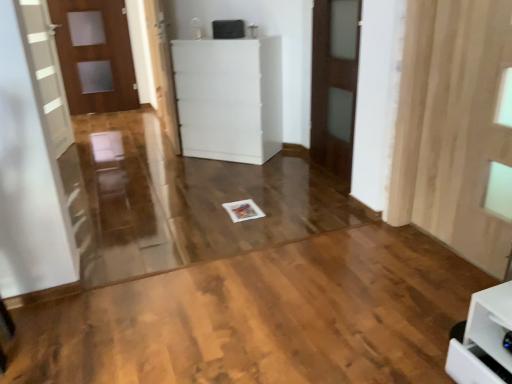
Question: From a real-world perspective, is white glossy door at center, which is the 2th door in front-to-back order, on matte wooden door at left, the first door viewed from the back?

Choices:
 (A) no
 (B) yes

Answer: (A)

Question: Is white glossy door at center, positioned as the second door in right-to-left order, not close to matte wooden door at left, the first door viewed from the back?

Choices:
 (A) yes
 (B) no

Answer: (A)

Question: Considering the relative sizes of white glossy door at center, acting as the second door starting from the back, and matte wooden door at left, marked as the 1th door in a left-to-right arrangement, in the image provided, is white glossy door at center, acting as the second door starting from the back, shorter than matte wooden door at left, marked as the 1th door in a left-to-right arrangement,?

Choices:
 (A) no
 (B) yes

Answer: (B)

Question: Does white glossy door at center, positioned as the second door in right-to-left order, have a lesser width compared to matte wooden door at left, positioned as the third door in right-to-left order?

Choices:
 (A) yes
 (B) no

Answer: (B)

Question: Is white glossy door at center, positioned as the second door in right-to-left order, positioned beyond the bounds of matte wooden door at left, the 3th door from the front?

Choices:
 (A) no
 (B) yes

Answer: (B)

Question: Looking at the image, does natural wood floor at center seem bigger or smaller compared to white plastic cabinet at center?

Choices:
 (A) big
 (B) small

Answer: (B)

Question: In the image, is natural wood floor at center on the left side or the right side of white plastic cabinet at center?

Choices:
 (A) left
 (B) right

Answer: (B)

Question: Is natural wood floor at center in front of or behind white plastic cabinet at center in the image?

Choices:
 (A) front
 (B) behind

Answer: (A)

Question: From the image's perspective, is natural wood floor at center located above or below white plastic cabinet at center?

Choices:
 (A) above
 (B) below

Answer: (B)

Question: Is white plastic cabinet at center spatially inside brown wooden door at center, acting as the third door starting from the left, or outside of it?

Choices:
 (A) inside
 (B) outside

Answer: (B)

Question: From a real-world perspective, is white plastic cabinet at center positioned above or below brown wooden door at center, acting as the third door starting from the left?

Choices:
 (A) above
 (B) below

Answer: (B)

Question: Considering the positions of white plastic cabinet at center and brown wooden door at center, which is counted as the 3th door, starting from the back, in the image, is white plastic cabinet at center wider or thinner than brown wooden door at center, which is counted as the 3th door, starting from the back,?

Choices:
 (A) thin
 (B) wide

Answer: (B)

Question: In terms of size, does white plastic cabinet at center appear bigger or smaller than brown wooden door at center, the first door when ordered from right to left?

Choices:
 (A) big
 (B) small

Answer: (A)

Question: Looking at the image, does matte wooden door at left, the 3th door from the front, seem bigger or smaller compared to white glossy door at center, positioned as the second door in right-to-left order?

Choices:
 (A) big
 (B) small

Answer: (B)

Question: From a real-world perspective, relative to white glossy door at center, positioned as the second door in right-to-left order, is matte wooden door at left, the 3th door from the front, vertically above or below?

Choices:
 (A) below
 (B) above

Answer: (B)